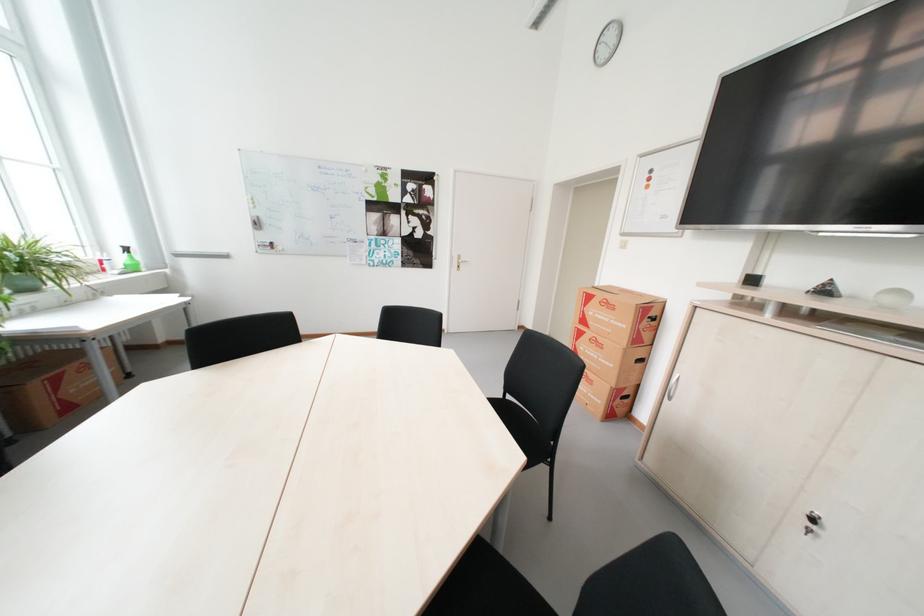
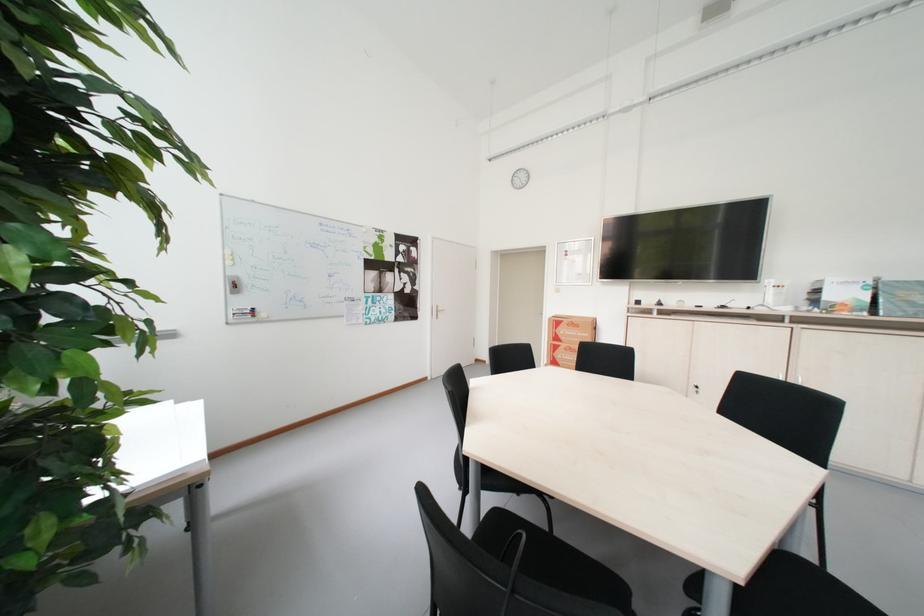
Find the pixel in the second image that matches (x=452, y=253) in the first image.

(434, 305)